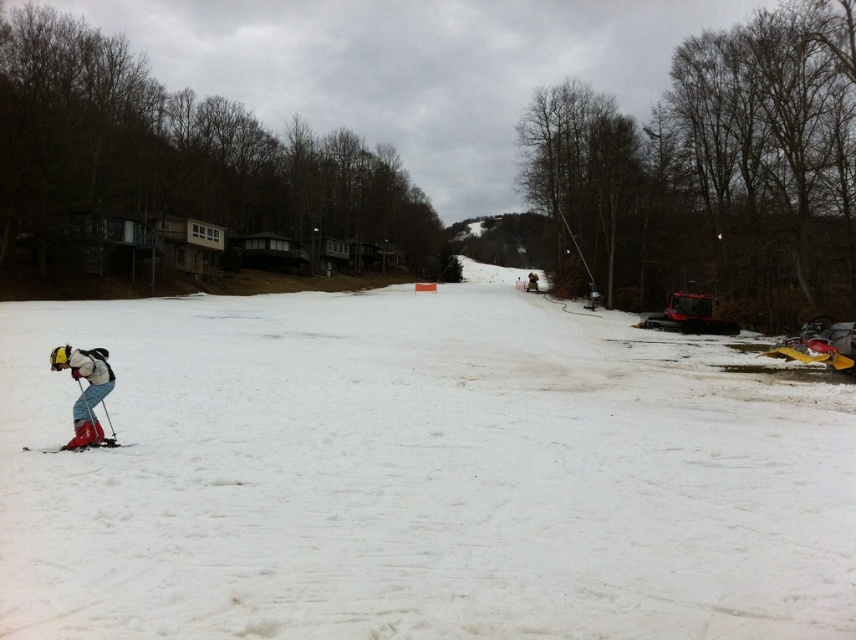
You are a skier trying to reach the orange marker on the slope. You see the white powdery snow at center and the matte red ski at lower left. Which object is closer to you as you stand at the starting point?

The matte red ski at lower left is closer to you because it is only 52.88 feet away from the white powdery snow at center, but since you are at the starting point, the ski is positioned lower left which might be nearer.

You are a photographer trying to capture the skier in the snowy scene. You notice the matte red ski suit at lower left and the matte red ski at lower left. Which object appears smaller in the image?

The matte red ski suit at lower left has a smaller size compared to the matte red ski at lower left, so the matte red ski suit at lower left appears smaller.

You are a drone operator trying to capture a photo of the matte red ski suit at lower left and the white powdery snow at center. Your drone has a camera with a 15 meter range. Can you capture both objects in one photo without moving the drone?

The distance between the white powdery snow at center and the matte red ski suit at lower left is 23.75 meters. Since the drone camera has a 15 meter range, it cannot capture both objects in one photo without moving the drone because the distance exceeds the camera range.